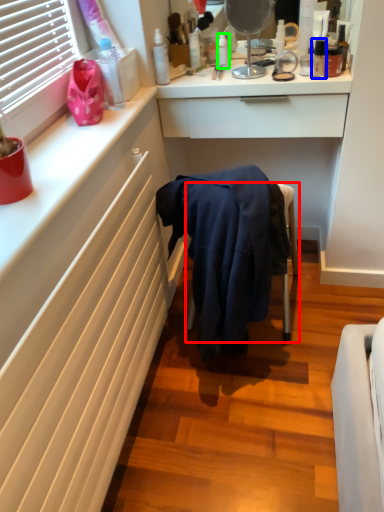
Question: Based on their relative distances, which object is farther from furniture (highlighted by a red box)? Choose from toiletry (highlighted by a blue box) and toiletry (highlighted by a green box).

Choices:
 (A) toiletry
 (B) toiletry

Answer: (B)